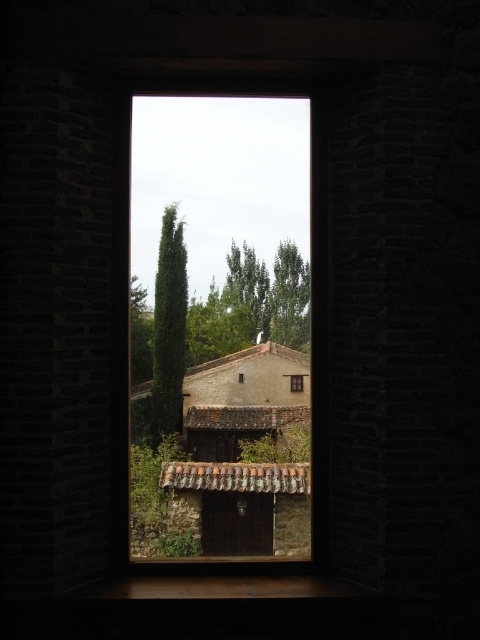
Question: Can you confirm if brown stone window at center is bigger than green textured cypress tree at center?

Choices:
 (A) yes
 (B) no

Answer: (A)

Question: Which object is the closest to the brown stone window at center?

Choices:
 (A) green textured cypress tree at center
 (B) matte brown wooden window at center

Answer: (A)

Question: Which point is closer to the camera?

Choices:
 (A) (211, 307)
 (B) (160, 355)

Answer: (A)

Question: Can you confirm if brown stone window at center is thinner than green leafy tree at upper center?

Choices:
 (A) yes
 (B) no

Answer: (B)

Question: Can you confirm if brown stone window at center is positioned to the right of green textured cypress tree at center?

Choices:
 (A) no
 (B) yes

Answer: (B)

Question: Which of the following is the farthest from the observer?

Choices:
 (A) brown stone window at center
 (B) green textured cypress tree at center
 (C) matte brown wooden window at center

Answer: (C)